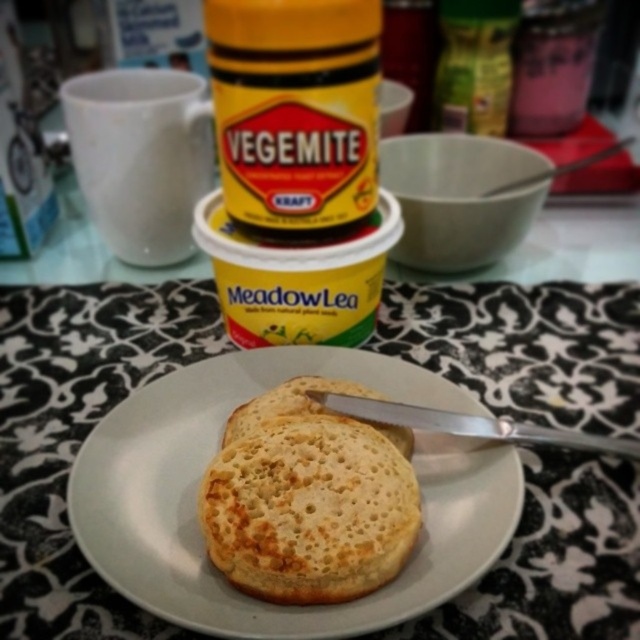
You are setting up a breakfast table and want to place a decorative napkin under the white matte plate at center. The napkin must be large enough to cover the entire bottom surface of the plate. If the napkin you have is the same size as the white matte mug at upper left, will it be sufficient?

The white matte plate at center has a larger width than the white matte mug at upper left. Since the napkin is the same size as the mug, it will not be large enough to cover the entire bottom surface of the plate.

You are setting up a breakfast table and want to place a white matte mug at upper left so it doesn not block the view of the white matte plate at center. Based on the current arrangement, is the mug positioned correctly?

The white matte plate at center is located below the white matte mug at upper left, so the mug is placed above the plate and does not block its view.